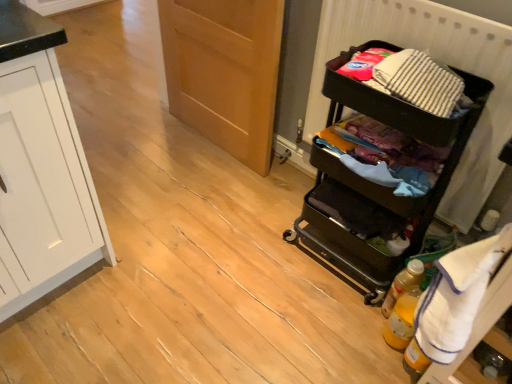
Question: Is striped cotton laundry at right behind translucent yellow bottle at lower right, placed as the first bottle when sorted from front to back?

Choices:
 (A) no
 (B) yes

Answer: (A)

Question: Is striped cotton laundry at right in front of translucent yellow bottle at lower right, arranged as the 2th bottle when viewed from the back?

Choices:
 (A) yes
 (B) no

Answer: (A)

Question: Is striped cotton laundry at right not close to translucent yellow bottle at lower right, arranged as the 2th bottle when viewed from the back?

Choices:
 (A) yes
 (B) no

Answer: (B)

Question: Can you confirm if striped cotton laundry at right is wider than translucent yellow bottle at lower right, placed as the first bottle when sorted from front to back?

Choices:
 (A) no
 (B) yes

Answer: (B)

Question: Is striped cotton laundry at right surrounding translucent yellow bottle at lower right, arranged as the 2th bottle when viewed from the back?

Choices:
 (A) no
 (B) yes

Answer: (A)

Question: Is striped cotton laundry at right positioned beyond the bounds of translucent yellow bottle at lower right, arranged as the 2th bottle when viewed from the back?

Choices:
 (A) no
 (B) yes

Answer: (B)

Question: From a real-world perspective, is wooden door at center located higher than white terry cloth towel at right?

Choices:
 (A) no
 (B) yes

Answer: (A)

Question: Can you confirm if wooden door at center is positioned to the right of white terry cloth towel at right?

Choices:
 (A) no
 (B) yes

Answer: (A)

Question: Is wooden door at center far from white terry cloth towel at right?

Choices:
 (A) yes
 (B) no

Answer: (A)

Question: Is white terry cloth towel at right located within wooden door at center?

Choices:
 (A) no
 (B) yes

Answer: (A)

Question: From the image's perspective, is wooden door at center located beneath white terry cloth towel at right?

Choices:
 (A) yes
 (B) no

Answer: (B)

Question: Considering the relative sizes of wooden door at center and white terry cloth towel at right in the image provided, is wooden door at center smaller than white terry cloth towel at right?

Choices:
 (A) yes
 (B) no

Answer: (B)

Question: Is white terry cloth towel at right directly adjacent to translucent yellow bottle at lower right, the first bottle viewed from the back?

Choices:
 (A) no
 (B) yes

Answer: (A)